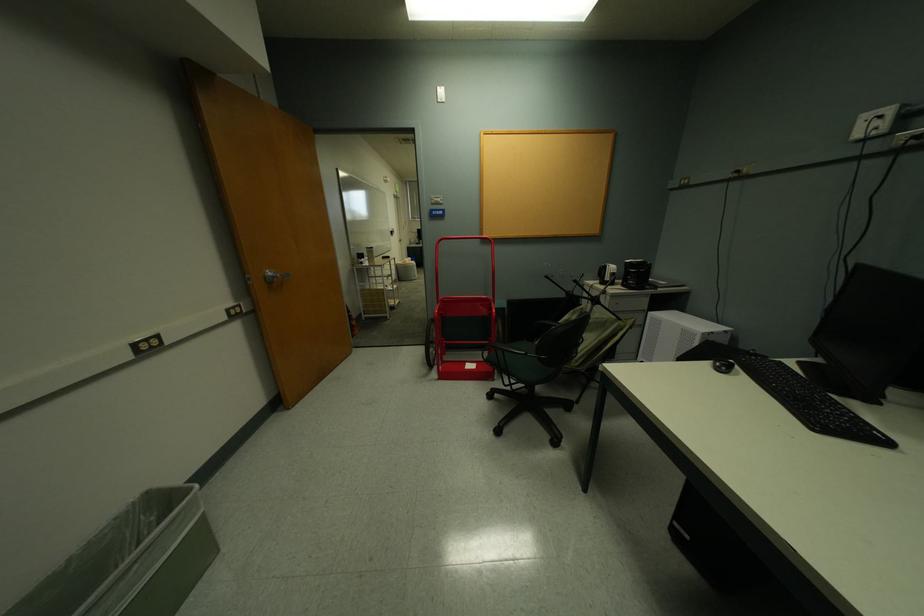
Identify the location of silver door handle. Image resolution: width=924 pixels, height=616 pixels. (274, 276).